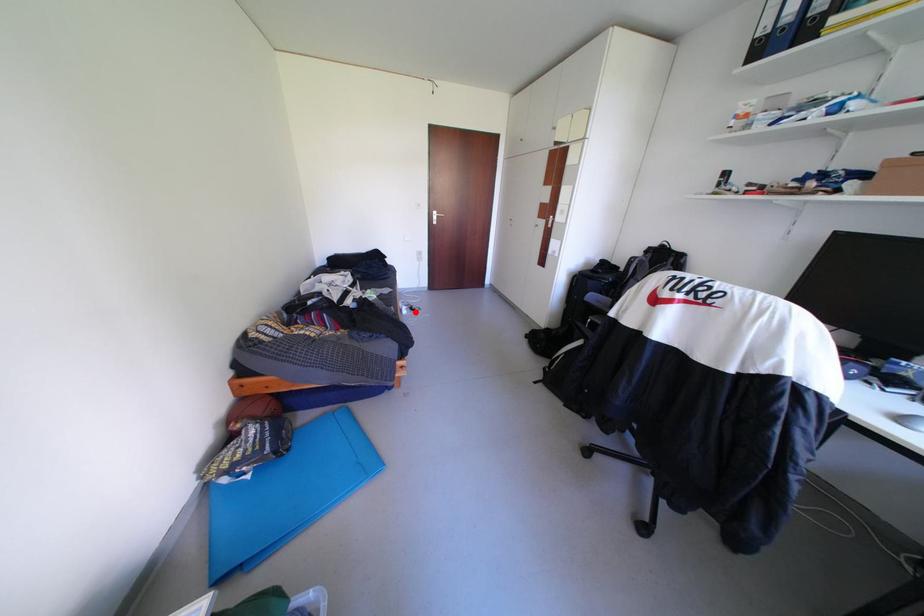
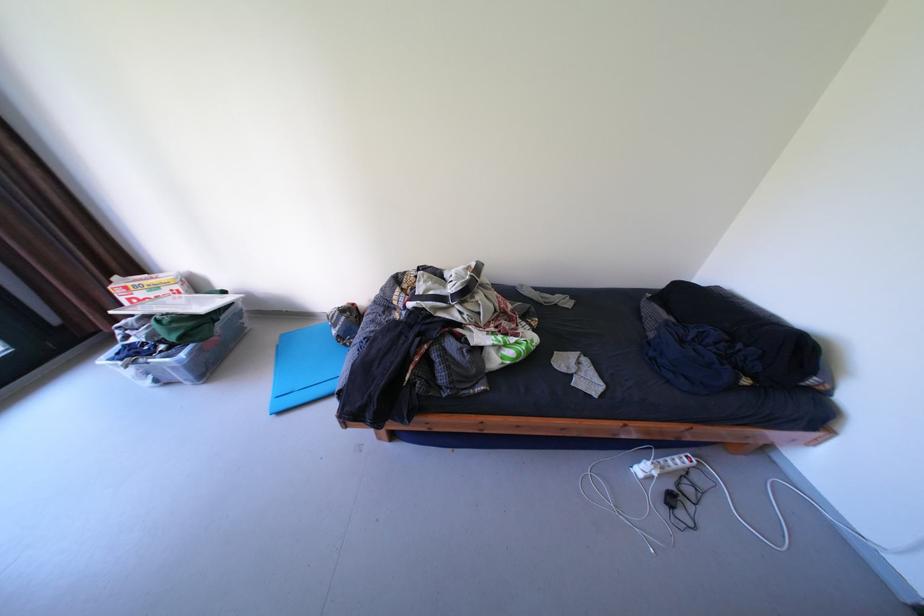
Find the pixel in the second image that matches the highlighted location in the first image.

(649, 471)